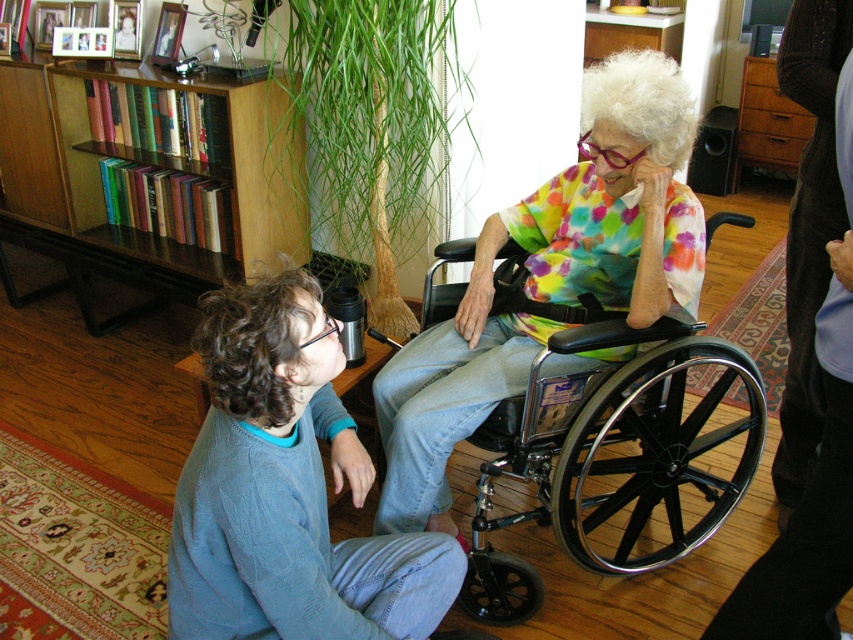
Who is shorter, multicolored tie-dye shirt at center or wooden bookshelf at upper left?

wooden bookshelf at upper left

Can you confirm if multicolored tie-dye shirt at center is shorter than wooden bookshelf at upper left?

No.

I want to click on multicolored tie-dye shirt at center, so click(x=550, y=276).

Identify the location of multicolored tie-dye shirt at center. The height and width of the screenshot is (640, 853). (550, 276).

Is point (524, 205) positioned in front of point (668, 548)?

No, it is behind (668, 548).

Can you confirm if multicolored tie-dye shirt at center is positioned to the right of black metal wheelchair at center?

No, multicolored tie-dye shirt at center is not to the right of black metal wheelchair at center.

At what (x,y) coordinates should I click in order to perform the action: click on multicolored tie-dye shirt at center. Please return your answer as a coordinate pair (x, y). This screenshot has height=640, width=853. Looking at the image, I should click on (550, 276).

Image resolution: width=853 pixels, height=640 pixels. I want to click on wooden bookshelf at upper left, so [x=149, y=179].

Which is more to the right, wooden bookshelf at upper left or black metal wheelchair at center?

From the viewer's perspective, black metal wheelchair at center appears more on the right side.

This screenshot has width=853, height=640. Identify the location of wooden bookshelf at upper left. (149, 179).